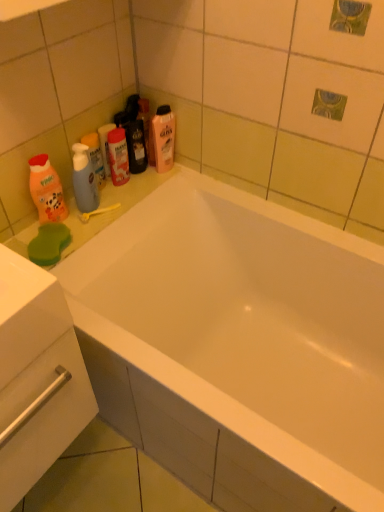
Where is `vacant area located to the right-hand side of translucent plastic mouthwash at upper left, which appears as the first mouthwash when viewed from the left`? This screenshot has width=384, height=512. vacant area located to the right-hand side of translucent plastic mouthwash at upper left, which appears as the first mouthwash when viewed from the left is located at coordinates (132, 189).